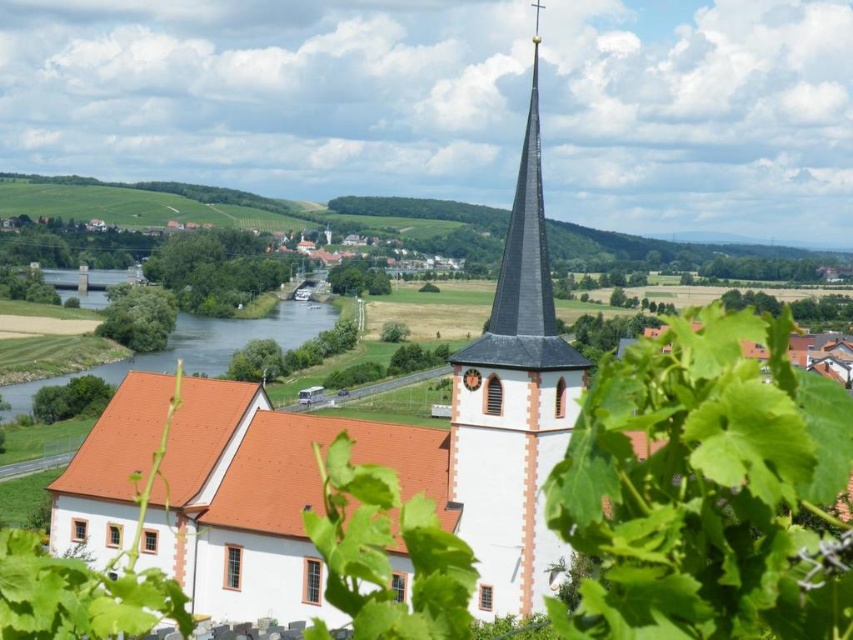
Question: Can you confirm if green grassy field at lower center is positioned to the left of black slate spire at upper center?

Choices:
 (A) yes
 (B) no

Answer: (A)

Question: Is white smooth steeple at center smaller than black slate spire at upper center?

Choices:
 (A) yes
 (B) no

Answer: (A)

Question: Which object is positioned farthest from the white smooth steeple at center?

Choices:
 (A) white stucco church at center
 (B) black slate spire at upper center

Answer: (A)

Question: Which of the following is the farthest from the observer?

Choices:
 (A) white stucco church at center
 (B) blue water at lower left
 (C) green grassy field at lower center

Answer: (C)

Question: Which object appears closest to the camera in this image?

Choices:
 (A) white stucco church at center
 (B) green grassy field at lower center
 (C) white smooth steeple at center

Answer: (C)

Question: Can you confirm if white smooth steeple at center is positioned above green grassy field at lower center?

Choices:
 (A) yes
 (B) no

Answer: (B)